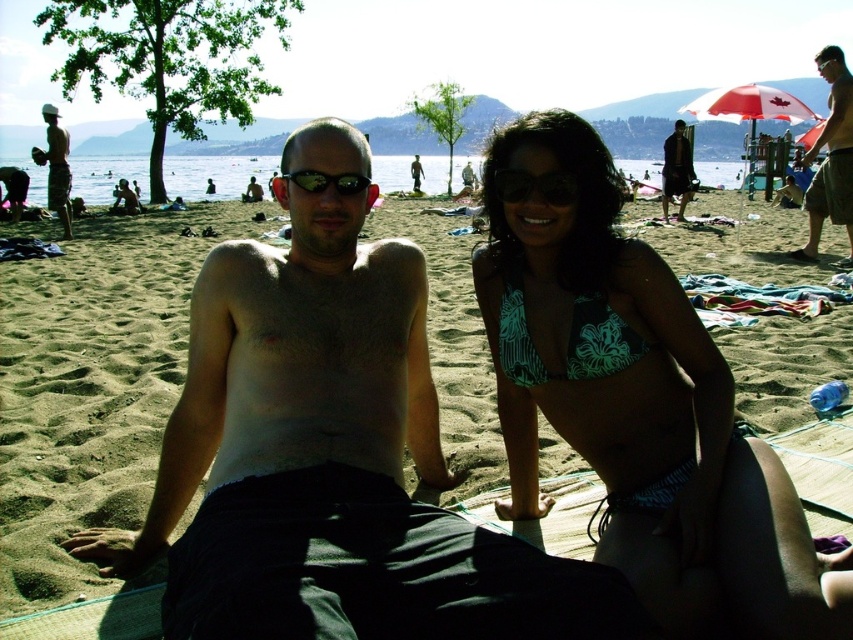
Question: Which point is closer to the camera taking this photo?

Choices:
 (A) (32, 156)
 (B) (628, 333)

Answer: (B)

Question: Which point appears closest to the camera in this image?

Choices:
 (A) (512, 198)
 (B) (502, 241)

Answer: (A)

Question: Can you confirm if teal floral bikini top at center is positioned to the right of green floral bikini top at upper right?

Choices:
 (A) yes
 (B) no

Answer: (A)

Question: Can you confirm if matte white hat at upper left is positioned below black plastic sunglasses at upper center?

Choices:
 (A) no
 (B) yes

Answer: (A)

Question: Can you confirm if smooth skin torso at center is wider than black plastic sunglasses at upper center?

Choices:
 (A) yes
 (B) no

Answer: (A)

Question: Which of the following is the farthest from the observer?

Choices:
 (A) black rubber goggles at center
 (B) matte white hat at upper left
 (C) smooth skin torso at center

Answer: (B)